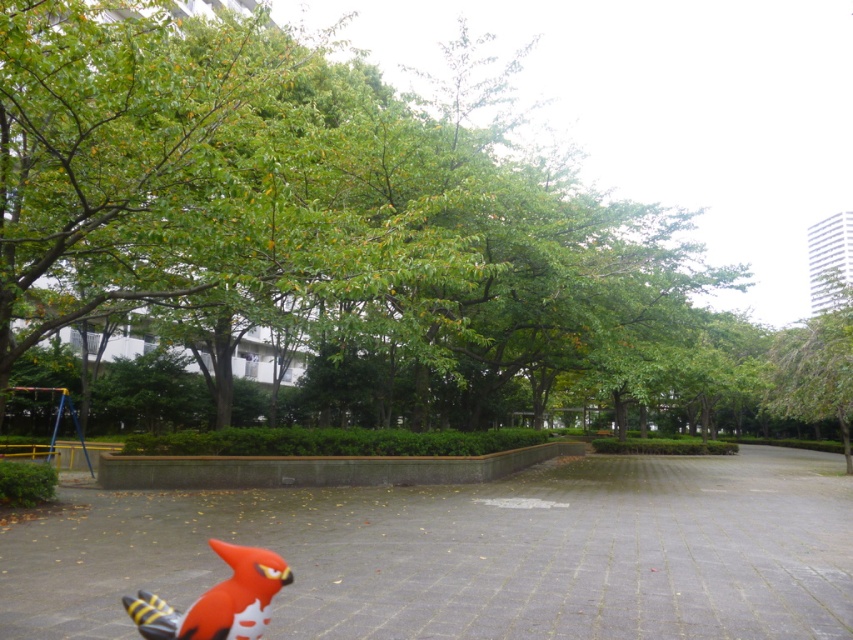
Is smooth concrete path at center positioned behind rubberized red bird at lower center?

Yes, smooth concrete path at center is behind rubberized red bird at lower center.

Can you confirm if smooth concrete path at center is positioned below rubberized red bird at lower center?

Yes, smooth concrete path at center is below rubberized red bird at lower center.

Describe the element at coordinates (473, 552) in the screenshot. I see `smooth concrete path at center` at that location.

At what (x,y) coordinates should I click in order to perform the action: click on smooth concrete path at center. Please return your answer as a coordinate pair (x, y). The image size is (853, 640). Looking at the image, I should click on (473, 552).

Can you confirm if green leafy tree at center is positioned to the right of rubberized red bird at lower center?

No, green leafy tree at center is not to the right of rubberized red bird at lower center.

Is green leafy tree at center positioned in front of rubberized red bird at lower center?

No, it is not.

Find the location of a particular element. Image resolution: width=853 pixels, height=640 pixels. green leafy tree at center is located at coordinates (296, 205).

In order to click on green leafy tree at upper right in this screenshot , I will do `click(816, 364)`.

Which is above, green leafy tree at upper right or rubberized red bird at lower center?

rubberized red bird at lower center is higher up.

Image resolution: width=853 pixels, height=640 pixels. I want to click on green leafy tree at upper right, so click(816, 364).

This screenshot has height=640, width=853. Identify the location of green leafy tree at upper right. (816, 364).